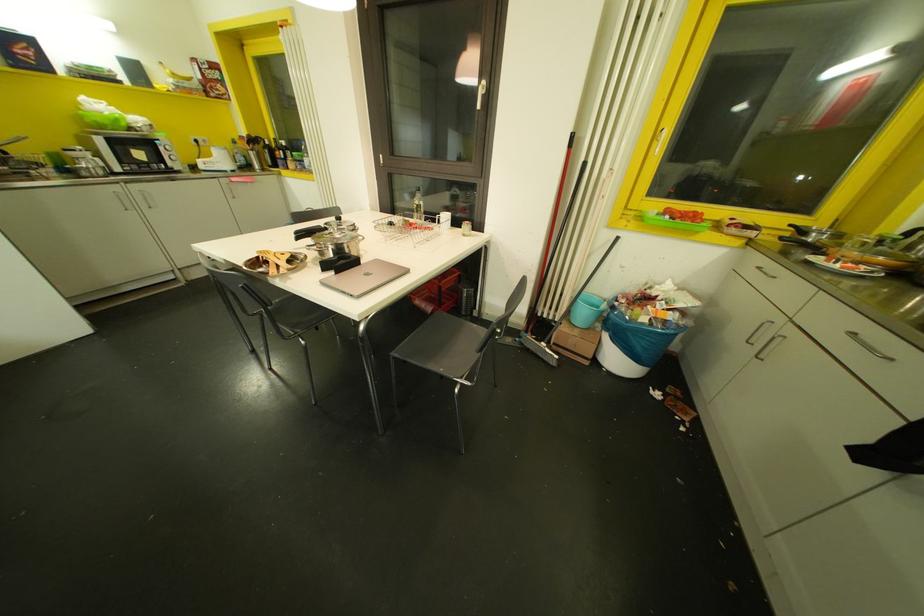
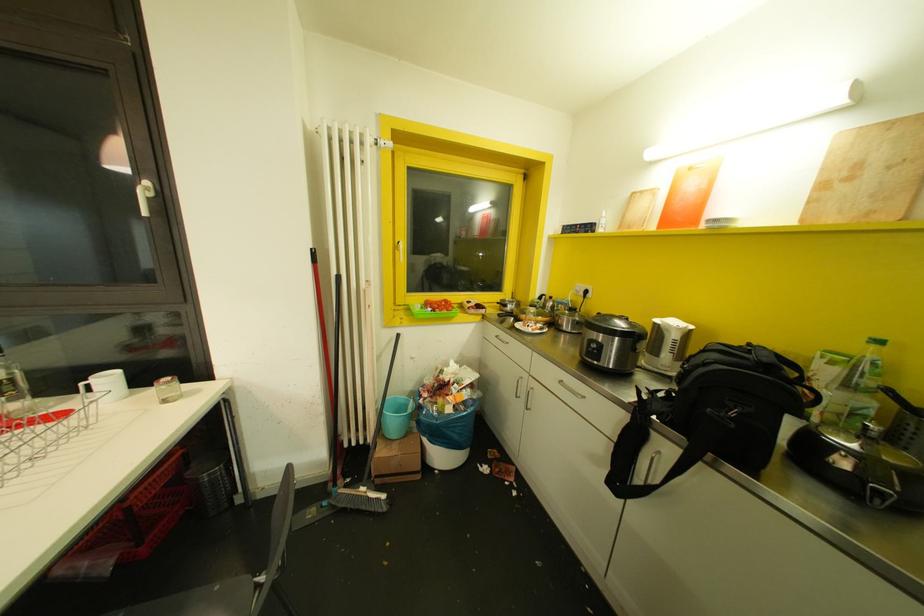
Question: The camera is either moving clockwise (left) or counter-clockwise (right) around the object. The first image is from the beginning of the video and the second image is from the end. Is the camera moving left or right when shooting the video?

Choices:
 (A) Left
 (B) Right

Answer: (A)